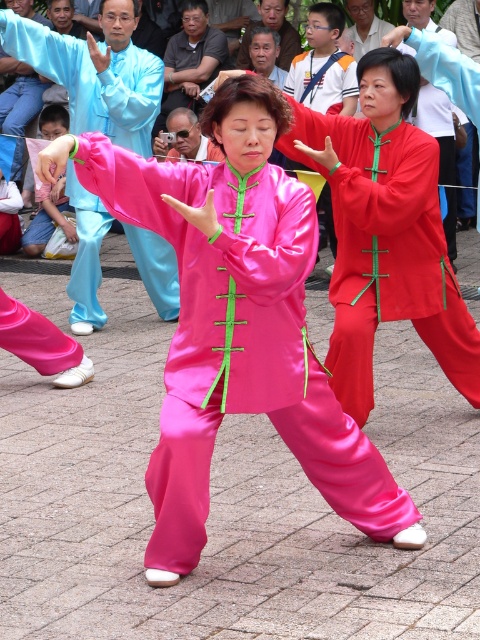
How much distance is there between light blue satin robe at left and light blue silk shirt at upper center?

light blue satin robe at left and light blue silk shirt at upper center are 14.14 feet apart.

Based on the photo, does light blue satin robe at left come in front of light blue silk shirt at upper center?

That is True.

Locate an element on the screen. light blue satin robe at left is located at coordinates (x=96, y=72).

Find the location of a particular element. The width and height of the screenshot is (480, 640). light blue satin robe at left is located at coordinates (96, 72).

Can you confirm if light blue satin robe at left is shorter than smooth brown face at upper center?

No, light blue satin robe at left is not shorter than smooth brown face at upper center.

Does light blue satin robe at left appear over smooth brown face at upper center?

No.

Where is `light blue satin robe at left`? light blue satin robe at left is located at coordinates (96, 72).

The image size is (480, 640). In order to click on light blue satin robe at left in this screenshot , I will do `click(96, 72)`.

Between silky red pants at center and light blue silk shirt at upper center, which one has less height?

With less height is light blue silk shirt at upper center.

Can you confirm if silky red pants at center is shorter than light blue silk shirt at upper center?

No, silky red pants at center is not shorter than light blue silk shirt at upper center.

What do you see at coordinates (385, 252) in the screenshot? I see `silky red pants at center` at bounding box center [385, 252].

Find the location of a particular element. The width and height of the screenshot is (480, 640). silky red pants at center is located at coordinates (385, 252).